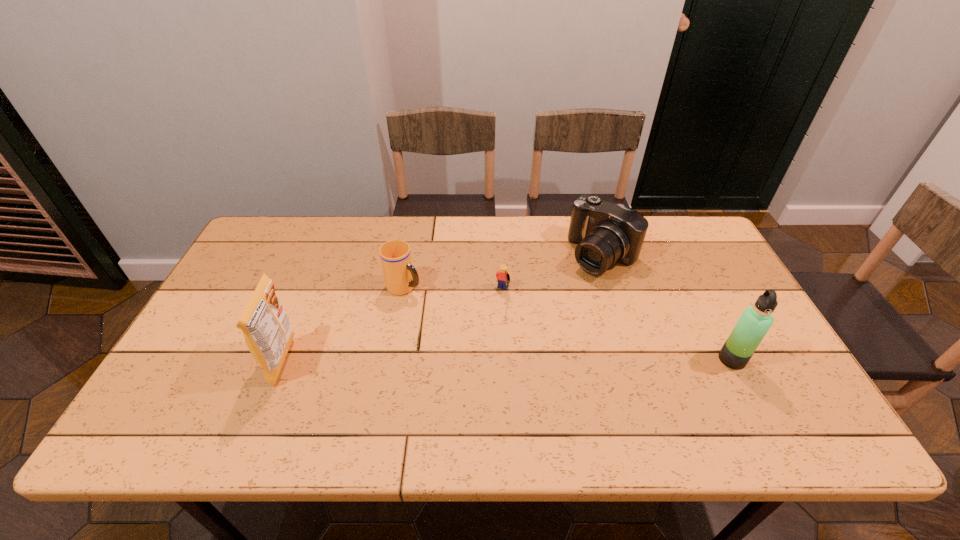
I want to click on empty location between the thermos bottle and the third object from right to left, so click(x=617, y=326).

Locate an element on the screen. The width and height of the screenshot is (960, 540). free space between the shortest object and the crisp (potato chip) is located at coordinates (393, 327).

Locate an element on the screen. Image resolution: width=960 pixels, height=540 pixels. free point between the leftmost object and the cup is located at coordinates (345, 325).

Locate an element on the screen. The width and height of the screenshot is (960, 540). free spot between the camera and the rightmost object is located at coordinates (667, 307).

You are a GUI agent. You are given a task and a screenshot of the screen. Output one action in this format:
    pyautogui.click(x=<x>, y=<y>)
    Task: Click on the free space between the thermos bottle and the second object from left to right
    The height and width of the screenshot is (540, 960).
    Given the screenshot: What is the action you would take?
    pyautogui.click(x=568, y=323)

At what (x,y) coordinates should I click in order to perform the action: click on vacant space that's between the camera and the crisp (potato chip). Please return your answer as a coordinate pair (x, y). This screenshot has width=960, height=540. Looking at the image, I should click on (444, 308).

You are a GUI agent. You are given a task and a screenshot of the screen. Output one action in this format:
    pyautogui.click(x=<x>, y=<y>)
    Task: Click on the vacant region between the thermos bottle and the fourth object from right to left
    The width and height of the screenshot is (960, 540).
    Given the screenshot: What is the action you would take?
    pyautogui.click(x=568, y=323)

Where is `unoccupied position between the shortest object and the thermos bottle`? This screenshot has width=960, height=540. unoccupied position between the shortest object and the thermos bottle is located at coordinates (617, 326).

Identify the location of the second closest object to the cup. (266, 327).

Locate an element on the screen. This screenshot has height=540, width=960. the closest object to the Lego is located at coordinates (606, 233).